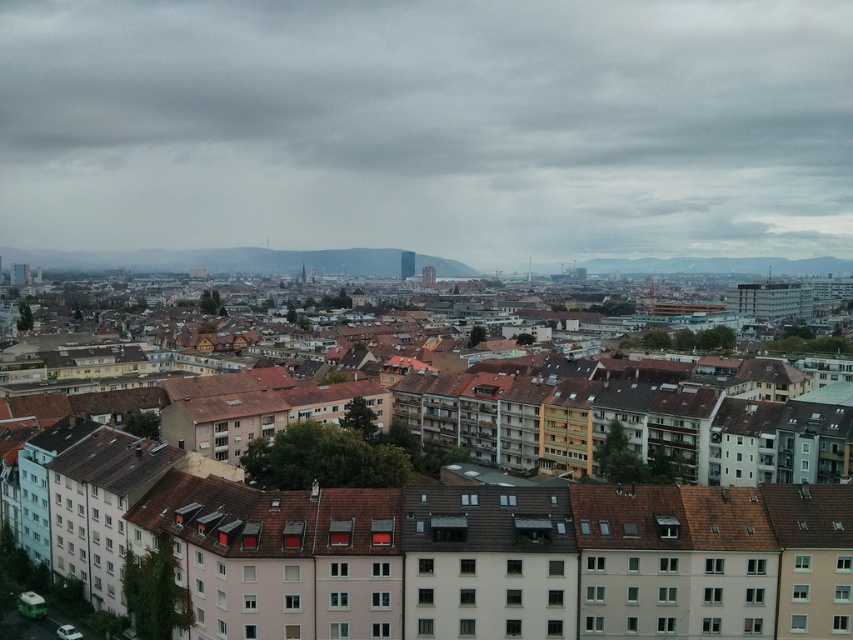
Question: Among these objects, which one is farthest from the camera?

Choices:
 (A) cloudy sky at center
 (B) matte brown buildings at center

Answer: (A)

Question: Can you confirm if cloudy sky at center is thinner than matte brown buildings at center?

Choices:
 (A) no
 (B) yes

Answer: (A)

Question: Which of the following is the closest to the observer?

Choices:
 (A) cloudy sky at center
 (B) matte brown buildings at center

Answer: (B)

Question: Can you confirm if cloudy sky at center is wider than matte brown buildings at center?

Choices:
 (A) no
 (B) yes

Answer: (B)

Question: Can you confirm if cloudy sky at center is positioned below matte brown buildings at center?

Choices:
 (A) yes
 (B) no

Answer: (B)